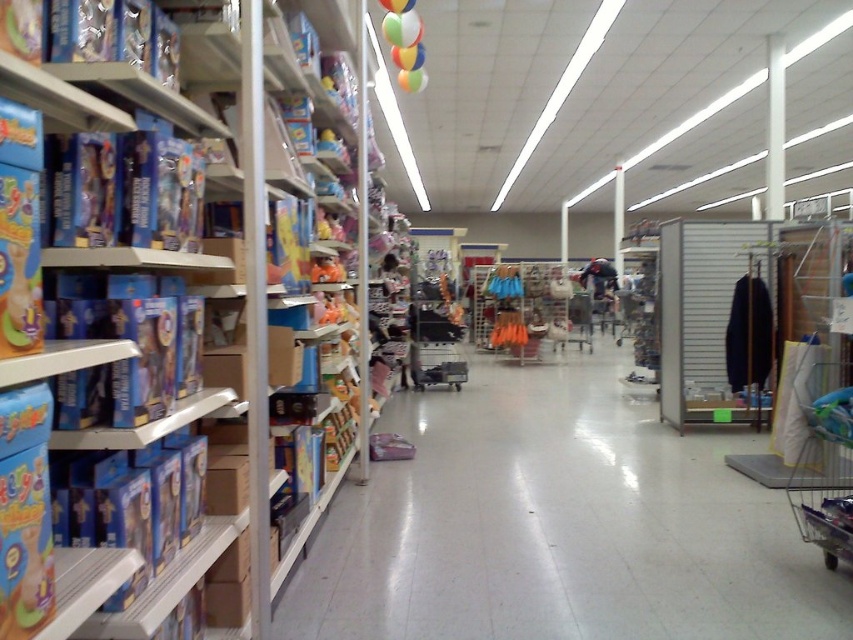
You are a customer in the store and want to take a metallic silver shopping cart. You see both the metallic silver shopping cart at lower right and the metallic silver shopping cart at center. Which one is bigger?

The metallic silver shopping cart at lower right is larger in size than the metallic silver shopping cart at center.

You are standing at the entrance of the toy store aisle and see a point marked at coordinates (143,273). Based on the scene description, can you determine what this point is indicating?

The point at coordinates (143,273) is indicating blue cardboard boxes at left.